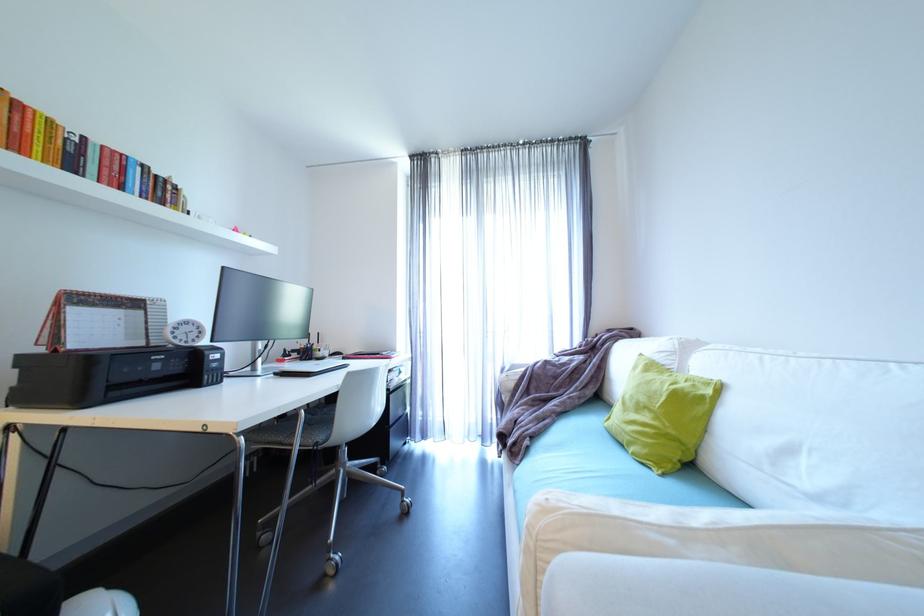
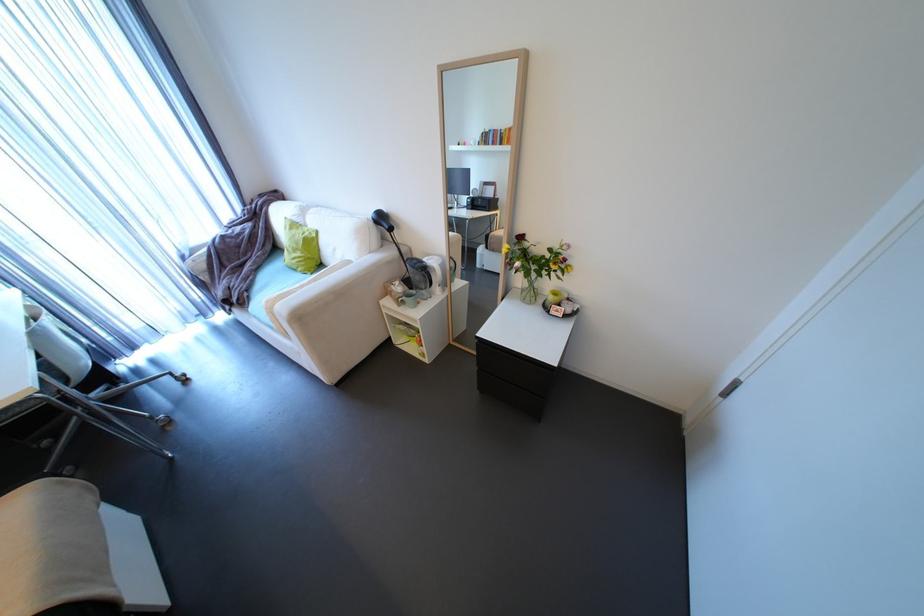
Where in the second image is the point corresponding to [216,431] from the first image?

(7, 408)